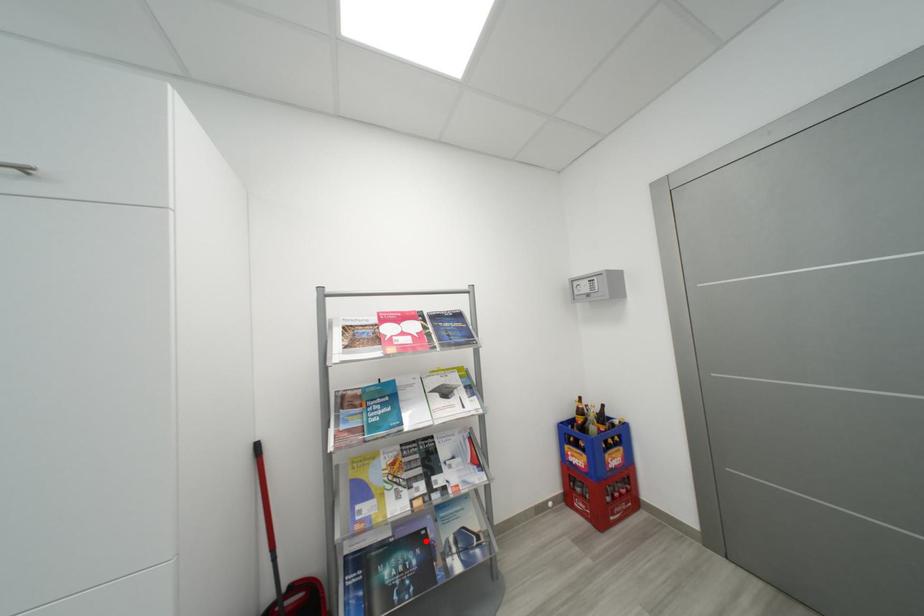
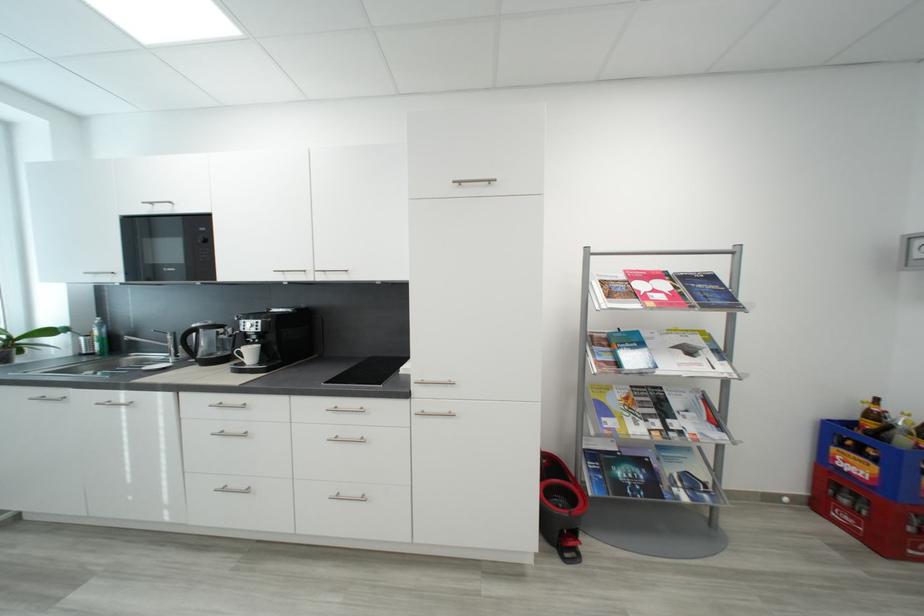
Where in the second image is the point corresponding to the highlighted location from the first image?

(650, 464)